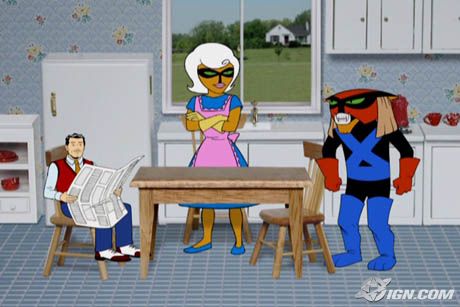
You are a GUI agent. You are given a task and a screenshot of the screen. Output one action in this format:
    pyautogui.click(x=<x>, y=<y>)
    Task: Click on the back wall
    The width and height of the screenshot is (460, 307).
    Given the screenshot: What is the action you would take?
    pyautogui.click(x=16, y=83), pyautogui.click(x=97, y=17), pyautogui.click(x=446, y=84), pyautogui.click(x=379, y=80)